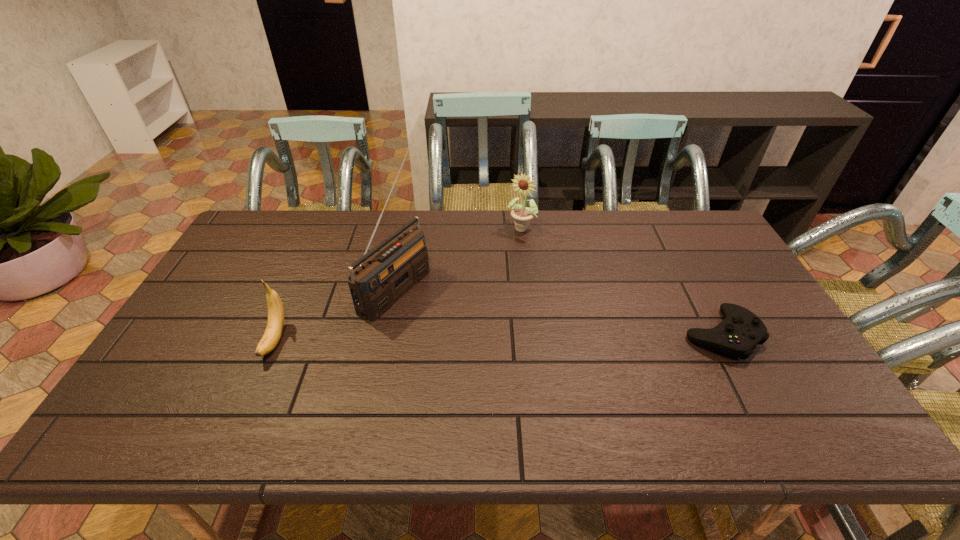
The height and width of the screenshot is (540, 960). I want to click on free space on the desktop that is between the leftmost object and the rightmost object and is positioned on the front-facing side of the second object from left to right, so click(498, 337).

Where is `vacant spot on the desktop that is between the leftmost object and the rightmost object and is positioned on the front-facing side of the sunflower`? Image resolution: width=960 pixels, height=540 pixels. vacant spot on the desktop that is between the leftmost object and the rightmost object and is positioned on the front-facing side of the sunflower is located at coordinates (440, 338).